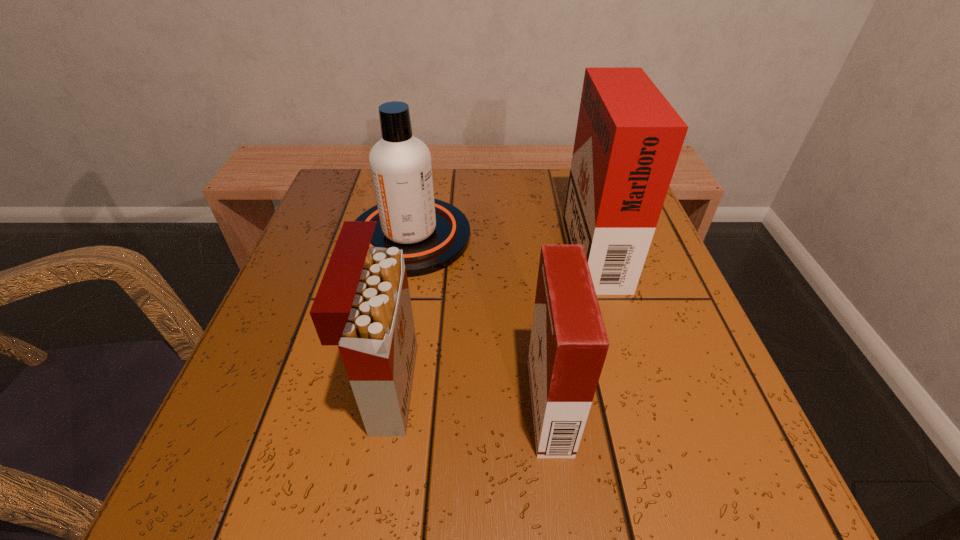
At what (x,y) coordinates should I click in order to perform the action: click on free space located 0.380m on the front-facing side of the second object from right to left. Please return your answer as a coordinate pair (x, y). Looking at the image, I should click on (275, 406).

Identify the location of free space located on the front-facing side of the second object from right to left. This screenshot has width=960, height=540. (356, 406).

This screenshot has height=540, width=960. Identify the location of free space located 0.240m on the front-facing side of the second object from right to left. click(x=370, y=406).

Locate an element on the screen. cigarette case present at the far edge is located at coordinates (628, 139).

In order to click on cleansing agent that is at the far edge in this screenshot , I will do `click(433, 234)`.

You are a GUI agent. You are given a task and a screenshot of the screen. Output one action in this format:
    pyautogui.click(x=<x>, y=<y>)
    Task: Click on the object located in the near edge section of the desktop
    Image resolution: width=960 pixels, height=540 pixels.
    Given the screenshot: What is the action you would take?
    pyautogui.click(x=568, y=346)

Find the location of `object located at the left edge`. object located at the left edge is located at coordinates (433, 234).

Locate an element on the screen. The image size is (960, 540). object located at the right edge is located at coordinates (628, 139).

In order to click on object at the far left corner in this screenshot , I will do `click(433, 234)`.

Locate an element on the screen. The height and width of the screenshot is (540, 960). object that is at the far right corner is located at coordinates (628, 139).